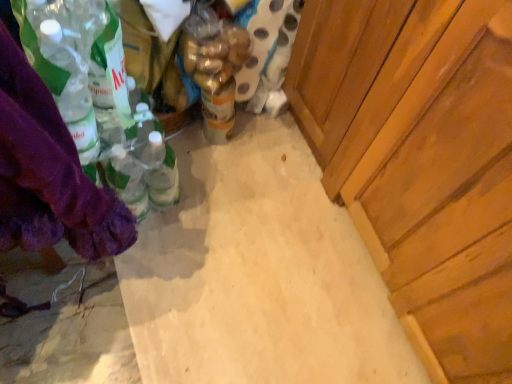
Question: Can you confirm if purple fabric at left is wider than wooden cabinet at right?

Choices:
 (A) yes
 (B) no

Answer: (B)

Question: From the image's perspective, is purple fabric at left on wooden cabinet at right?

Choices:
 (A) yes
 (B) no

Answer: (A)

Question: From a real-world perspective, does purple fabric at left sit lower than wooden cabinet at right?

Choices:
 (A) no
 (B) yes

Answer: (A)

Question: Is wooden cabinet at right a part of purple fabric at left?

Choices:
 (A) no
 (B) yes

Answer: (A)

Question: Is purple fabric at left closer to the viewer compared to wooden cabinet at right?

Choices:
 (A) yes
 (B) no

Answer: (A)

Question: Is translucent plastic bottle at center in front of or behind yellow matte can at center in the image?

Choices:
 (A) behind
 (B) front

Answer: (B)

Question: From a real-world perspective, is translucent plastic bottle at center physically located above or below yellow matte can at center?

Choices:
 (A) above
 (B) below

Answer: (A)

Question: Is point (224, 79) closer or farther from the camera than point (208, 102)?

Choices:
 (A) closer
 (B) farther

Answer: (A)

Question: Looking at the image, does translucent plastic bottle at center seem bigger or smaller compared to yellow matte can at center?

Choices:
 (A) small
 (B) big

Answer: (B)

Question: Is yellow matte can at center situated inside translucent plastic bottle at center or outside?

Choices:
 (A) inside
 (B) outside

Answer: (B)

Question: Considering their positions, is yellow matte can at center located in front of or behind translucent plastic bottle at center?

Choices:
 (A) behind
 (B) front

Answer: (A)

Question: From a real-world perspective, is yellow matte can at center physically located above or below translucent plastic bottle at center?

Choices:
 (A) below
 (B) above

Answer: (A)

Question: In the image, is yellow matte can at center on the left side or the right side of translucent plastic bottle at center?

Choices:
 (A) left
 (B) right

Answer: (A)

Question: Is wooden cabinet at right taller or shorter than purple fabric at left?

Choices:
 (A) tall
 (B) short

Answer: (B)

Question: Do you think wooden cabinet at right is within purple fabric at left, or outside of it?

Choices:
 (A) outside
 (B) inside

Answer: (A)